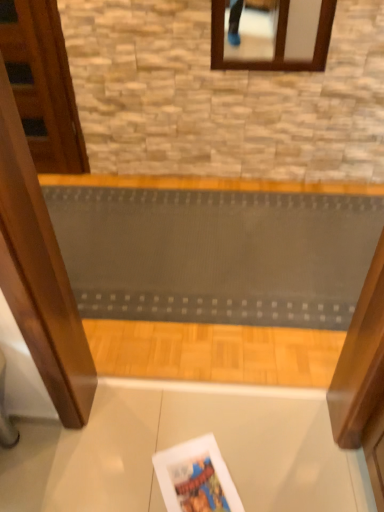
The height and width of the screenshot is (512, 384). I want to click on vacant space behind matte paper magazine at lower center, so click(201, 420).